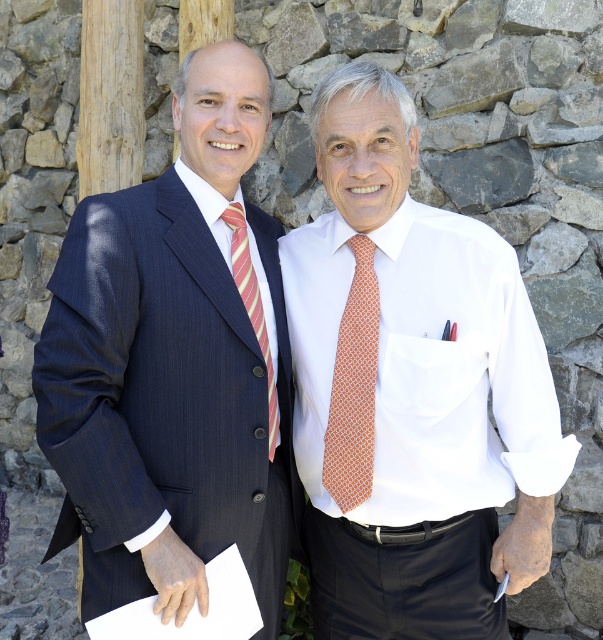
Which is more to the left, matte blue suit at left or white smooth dress shirt at center?

matte blue suit at left is more to the left.

Based on the photo, who is more distant from viewer, (x=197, y=216) or (x=499, y=308)?

The point (x=499, y=308) is behind.

This screenshot has height=640, width=603. What are the coordinates of `matte blue suit at left` in the screenshot? It's located at (175, 365).

Does matte blue suit at left have a lesser height compared to striped silk tie at center?

No, matte blue suit at left is not shorter than striped silk tie at center.

Which is more to the left, matte blue suit at left or striped silk tie at center?

matte blue suit at left

Does point (292, 493) lie behind point (250, 300)?

Yes, point (292, 493) is behind point (250, 300).

Locate an element on the screen. matte blue suit at left is located at coordinates (175, 365).

Measure the distance between matte blue suit at left and camera.

matte blue suit at left is 6.46 feet away from camera.

Between matte blue suit at left and white fabric pocket at center, which one has less height?

With less height is white fabric pocket at center.

Where is `matte blue suit at left`? matte blue suit at left is located at coordinates (175, 365).